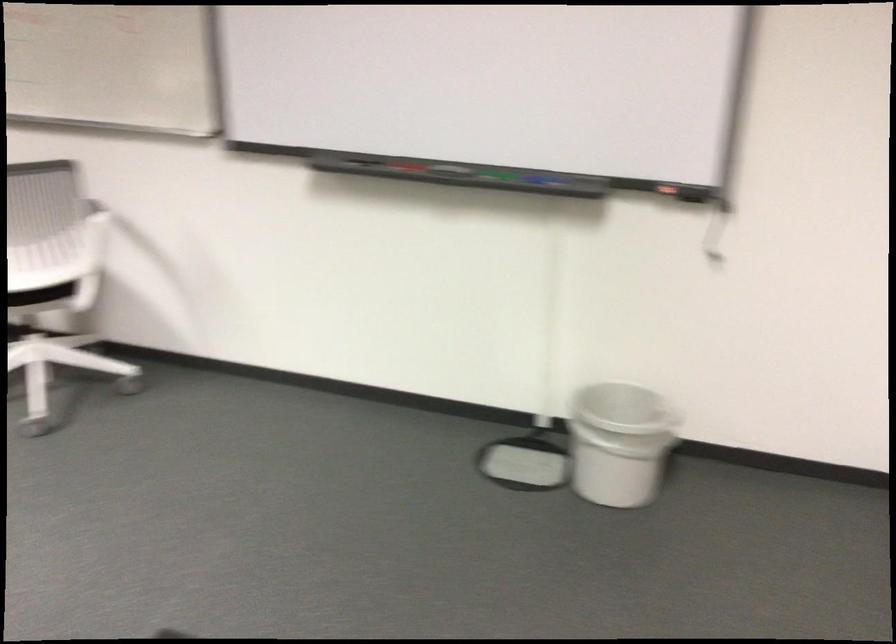
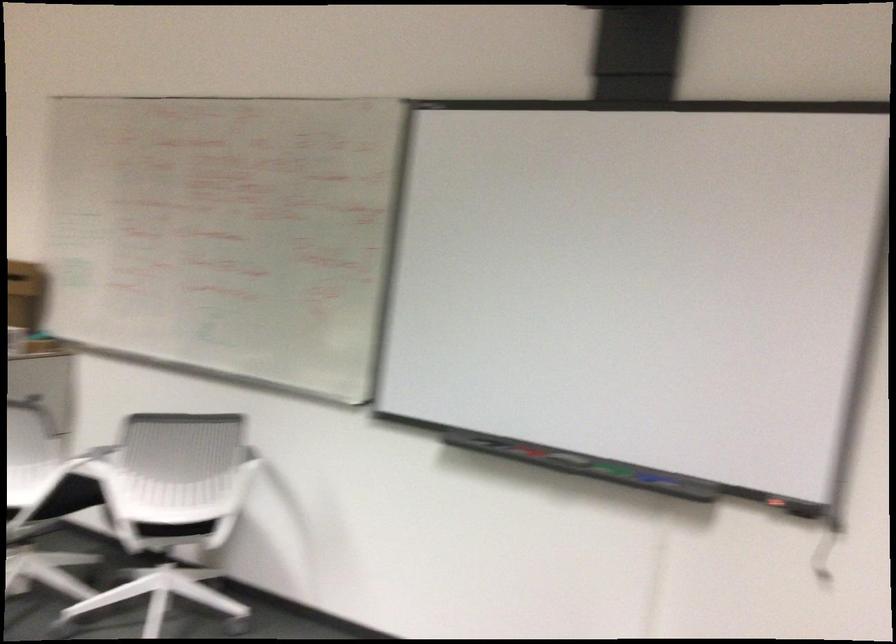
Find the pixel in the second image that matches (535,178) in the first image.

(650, 478)